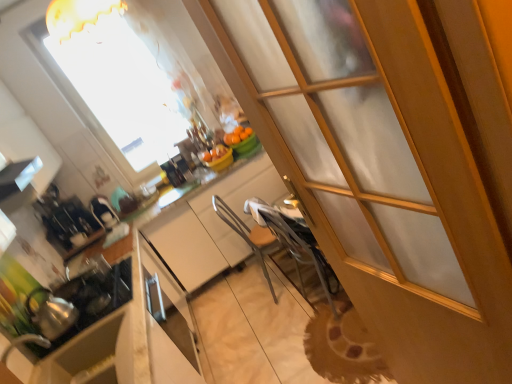
What are the coordinates of `vacant space to the right of shiny silver tea pot at lower left` in the screenshot? It's located at (94, 308).